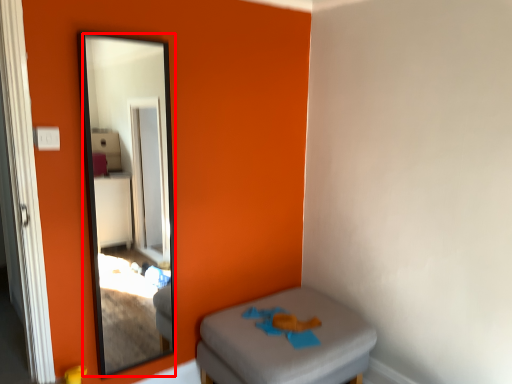
Question: Considering the relative positions of mirror (annotated by the red box) and furniture in the image provided, where is mirror (annotated by the red box) located with respect to the staircase?

Choices:
 (A) right
 (B) left

Answer: (B)